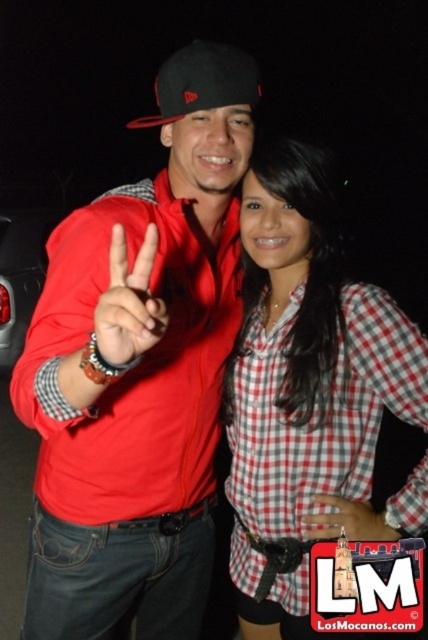
Between matte red jacket at center and checkered fabric shirt at center, which one appears on the right side from the viewer's perspective?

Positioned to the right is checkered fabric shirt at center.

Looking at this image, can you confirm if matte red jacket at center is positioned below checkered fabric shirt at center?

No, matte red jacket at center is not below checkered fabric shirt at center.

The image size is (428, 640). What do you see at coordinates (139, 371) in the screenshot?
I see `matte red jacket at center` at bounding box center [139, 371].

Image resolution: width=428 pixels, height=640 pixels. Find the location of `matte red jacket at center`. matte red jacket at center is located at coordinates (139, 371).

Does checkered fabric shirt at center have a lesser height compared to matte red hand at center?

No.

Who is lower down, checkered fabric shirt at center or matte red hand at center?

checkered fabric shirt at center

Locate an element on the screen. checkered fabric shirt at center is located at coordinates (305, 385).

Image resolution: width=428 pixels, height=640 pixels. What are the coordinates of `checkered fabric shirt at center` in the screenshot? It's located at (305, 385).

Is matte red jacket at center positioned before metallic red car at left?

Yes.

Which of these two, matte red jacket at center or metallic red car at left, stands shorter?

metallic red car at left is shorter.

The image size is (428, 640). I want to click on matte red jacket at center, so click(139, 371).

Identify the location of matte red jacket at center. The width and height of the screenshot is (428, 640). (139, 371).